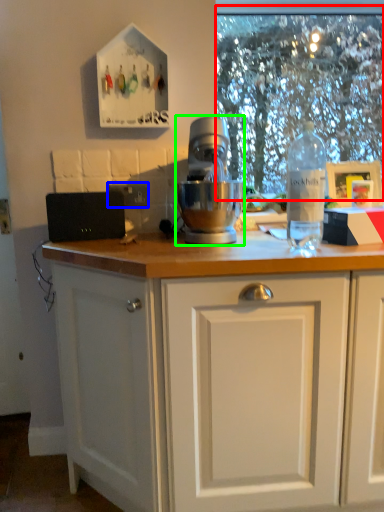
Question: Considering the real-world distances, which object is closest to clear (highlighted by a red box)? electric outlet (highlighted by a blue box) or mixer (highlighted by a green box).

Choices:
 (A) electric outlet
 (B) mixer

Answer: (B)